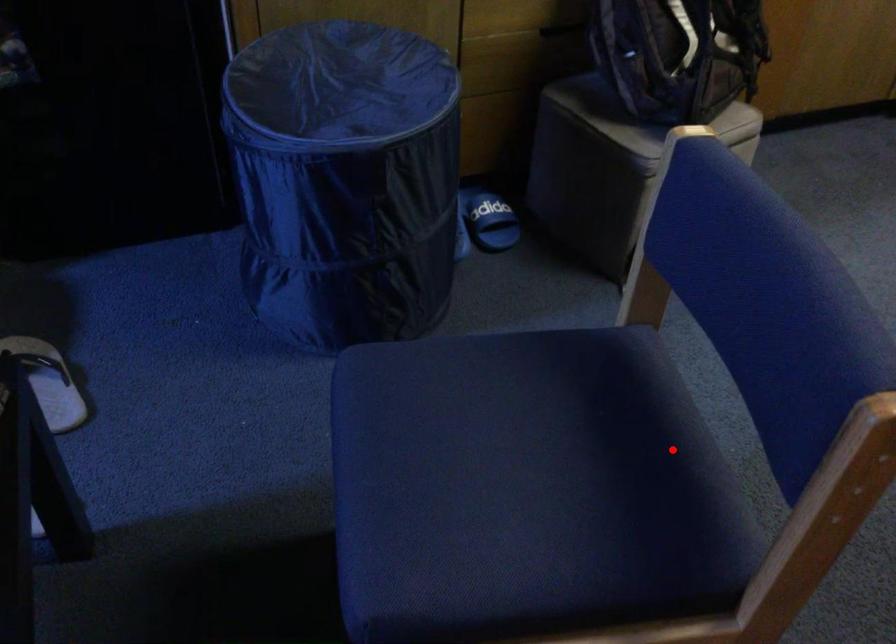
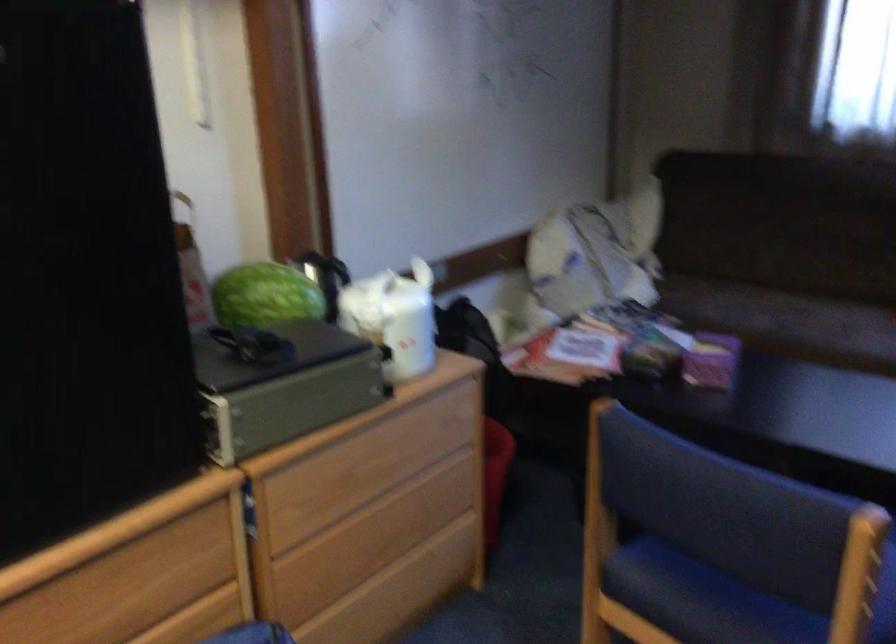
Where in the second image is the point corresponding to the highlighted location from the first image?

(702, 599)